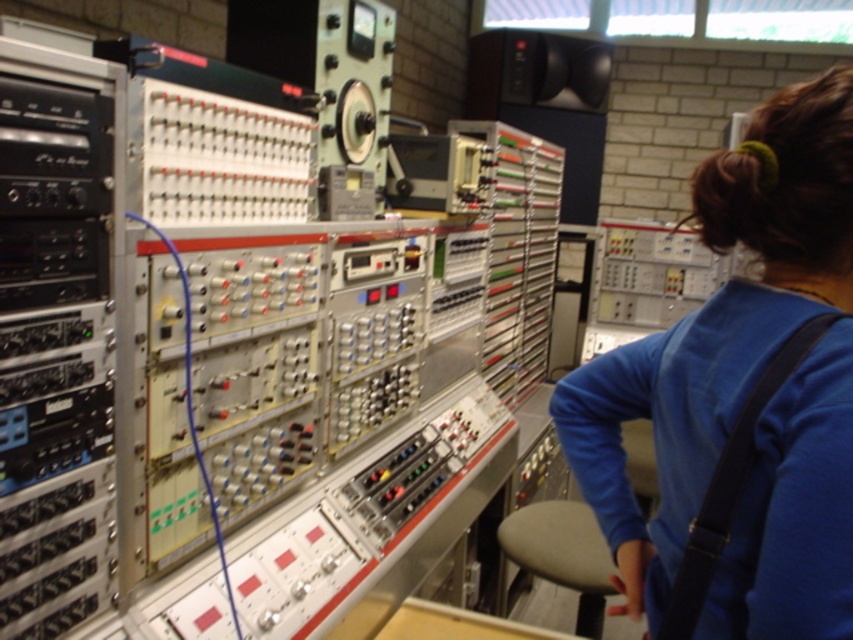
You are a technician in this control room and need to identify which object is larger between the blue fabric shirt at center and the gray fabric stool at lower center. Based on the scene description, which one is bigger?

The blue fabric shirt at center is bigger than the gray fabric stool at lower center according to the description.

You are an engineer in the control room and need to access the gray fabric stool at lower center. Is the blue fabric shirt at center blocking your path to it?

The blue fabric shirt at center is in front of the gray fabric stool at lower center, so the shirt is blocking the path to the stool.